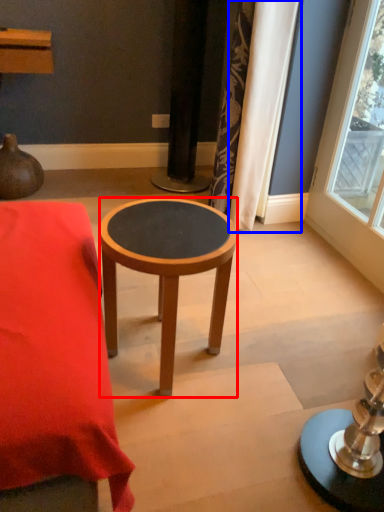
Question: Which point is closer to the camera, stool (highlighted by a red box) or curtain (highlighted by a blue box)?

Choices:
 (A) stool
 (B) curtain

Answer: (A)